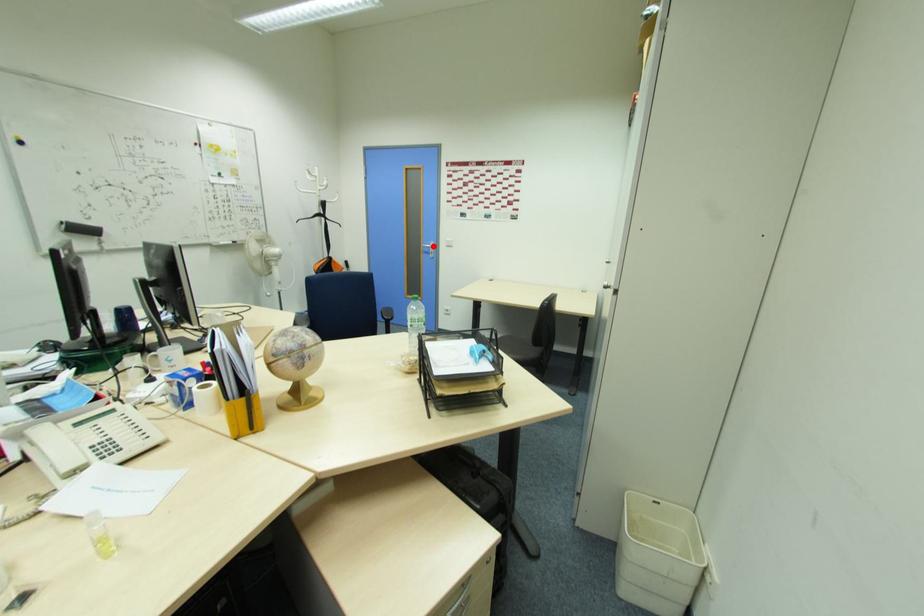
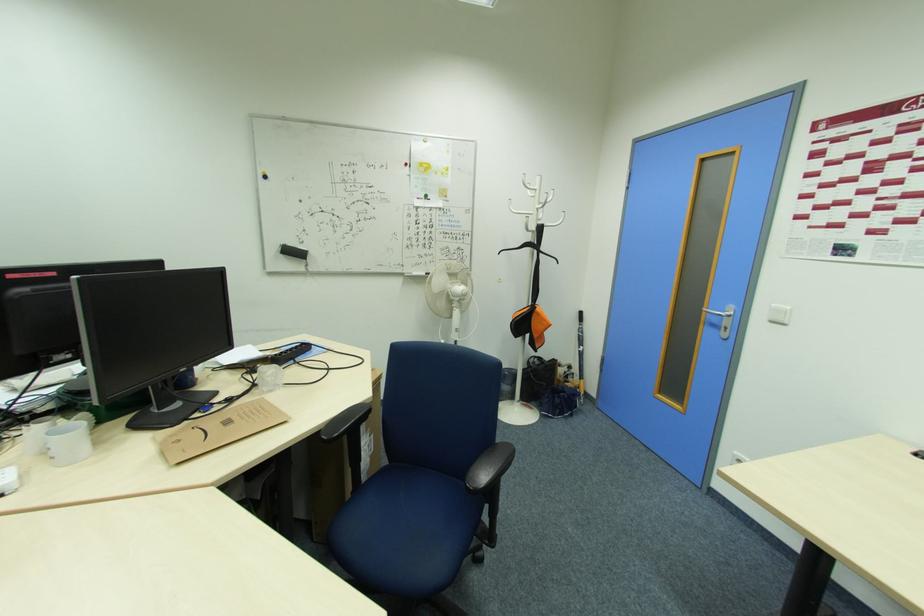
Question: I am providing you with two images of the same scene from different viewpoints. Given a red point in image1, look at the same physical point in image2. Is it:

Choices:
 (A) Closer to the viewpoint
 (B) Farther from the viewpoint

Answer: (B)